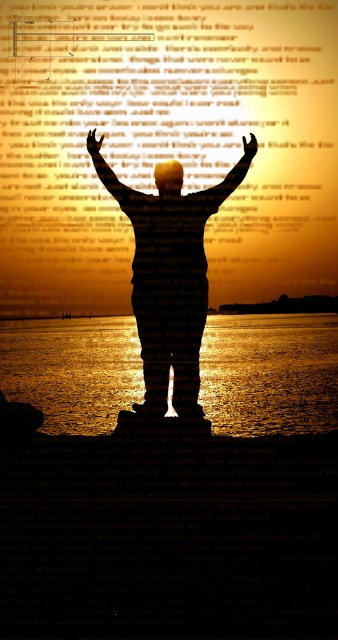
You are an artist analyzing this image. You notice the silhouette figure at center and the matte black hand at center. Which object is closer to the viewer?

The silhouette figure at center is closer to the viewer because it is in front of the matte black hand at center.

Based on the scene description, can you determine which object is positioned lower in the image between the golden reflective water at center and the silhouette figure at center?

The golden reflective water at center is located below the silhouette figure at center, so it is positioned lower in the image.